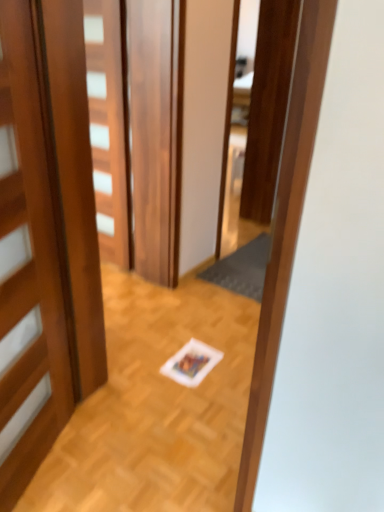
Question: Can you confirm if dark gray textured mat at center is shorter than wooden door at left, which is counted as the 2th door, starting from the back?

Choices:
 (A) no
 (B) yes

Answer: (B)

Question: Is dark gray textured mat at center looking in the opposite direction of wooden door at left, arranged as the 1th door when viewed from the front?

Choices:
 (A) yes
 (B) no

Answer: (B)

Question: From a real-world perspective, is dark gray textured mat at center positioned under wooden door at left, which is counted as the 2th door, starting from the back, based on gravity?

Choices:
 (A) yes
 (B) no

Answer: (A)

Question: Considering the relative sizes of dark gray textured mat at center and wooden door at left, arranged as the 1th door when viewed from the front, in the image provided, is dark gray textured mat at center wider than wooden door at left, arranged as the 1th door when viewed from the front,?

Choices:
 (A) no
 (B) yes

Answer: (B)

Question: Does dark gray textured mat at center have a lesser width compared to wooden door at left, which is counted as the 2th door, starting from the back?

Choices:
 (A) no
 (B) yes

Answer: (A)

Question: Considering the positions of wooden door at center, which appears as the first door when viewed from the back, and wooden door at left, arranged as the 1th door when viewed from the front, in the image, is wooden door at center, which appears as the first door when viewed from the back, wider or thinner than wooden door at left, arranged as the 1th door when viewed from the front,?

Choices:
 (A) thin
 (B) wide

Answer: (A)

Question: In the image, is wooden door at center, which is counted as the 2th door, starting from the front, positioned in front of or behind wooden door at left, arranged as the 1th door when viewed from the front?

Choices:
 (A) front
 (B) behind

Answer: (B)

Question: From a real-world perspective, is wooden door at center, which appears as the first door when viewed from the back, above or below wooden door at left, which is counted as the 2th door, starting from the back?

Choices:
 (A) above
 (B) below

Answer: (A)

Question: Visually, is wooden door at center, which is counted as the 2th door, starting from the front, positioned to the left or to the right of wooden door at left, arranged as the 1th door when viewed from the front?

Choices:
 (A) left
 (B) right

Answer: (B)

Question: Based on their positions, is dark gray textured mat at center located to the left or right of wooden door at left, which is counted as the 2th door, starting from the back?

Choices:
 (A) left
 (B) right

Answer: (B)

Question: Is dark gray textured mat at center in front of or behind wooden door at left, which is counted as the 2th door, starting from the back, in the image?

Choices:
 (A) front
 (B) behind

Answer: (B)

Question: From their relative heights in the image, would you say dark gray textured mat at center is taller or shorter than wooden door at left, arranged as the 1th door when viewed from the front?

Choices:
 (A) tall
 (B) short

Answer: (B)

Question: Looking at the image, does dark gray textured mat at center seem bigger or smaller compared to wooden door at left, arranged as the 1th door when viewed from the front?

Choices:
 (A) big
 (B) small

Answer: (B)

Question: From the image's perspective, is dark gray textured mat at center located above or below wooden door at center, which is counted as the 2th door, starting from the front?

Choices:
 (A) above
 (B) below

Answer: (B)

Question: Relative to wooden door at center, which is counted as the 2th door, starting from the front, is dark gray textured mat at center in front or behind?

Choices:
 (A) front
 (B) behind

Answer: (B)